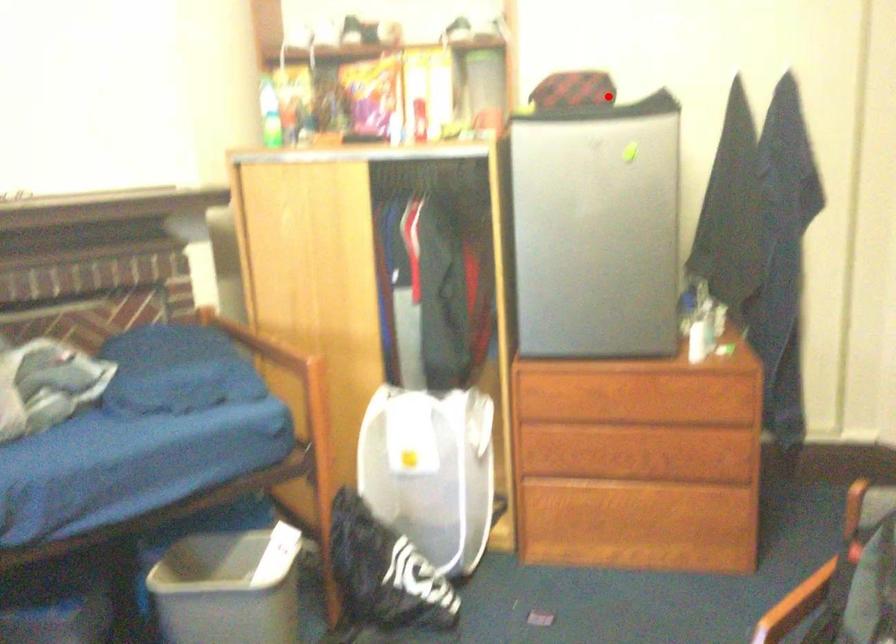
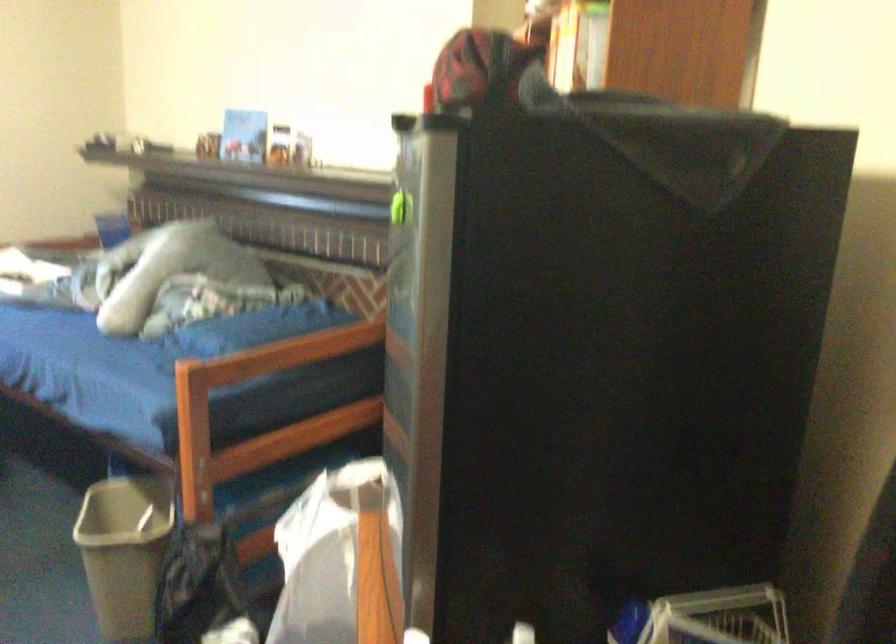
Question: I am providing you with two images of the same scene from different viewpoints. A red point is shown in image1. For the corresponding object point in image2, is it positioned nearer or farther from the camera?

Choices:
 (A) Nearer
 (B) Farther

Answer: (A)